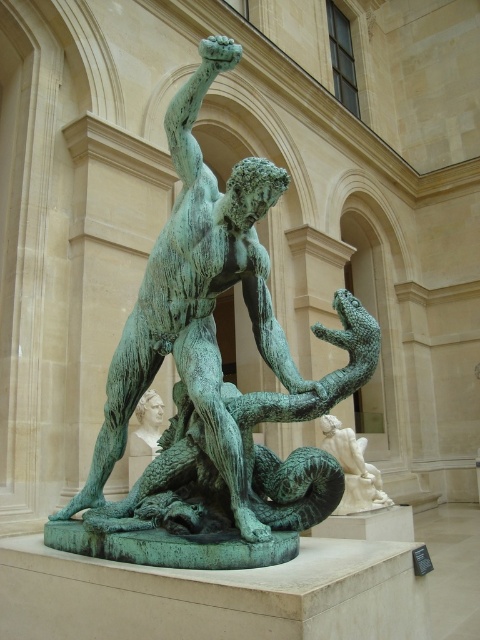
Consider the image. You are an art conservator assessing the space between two white marble artworks in the museum. The white marble statue at center and the smooth white marble bust at center are positioned side by side. Based on their sizes, which one would you need to use a taller ladder to reach the top?

The white marble statue at center is taller than the smooth white marble bust at center, so you would need a taller ladder to reach the top of the white marble statue at center.

You are a museum visitor who wants to take a photo of the green patina bronze statue at center. The museum requires visitors to maintain a distance of at least 2 meters from the statue to prevent damage. If you are standing at point (213, 381), can you take the photo while complying with the rule?

The green patina bronze statue at center is located at point (213, 381). If you are already standing at that exact point, you are at the same location as the statue, making it impossible to maintain the required 2 meters distance. Therefore, you cannot take the photo while complying with the rule.

You are a museum curator planning to install a new security system. You need to place a motion sensor between the green patina bronze statue at center and the smooth white marble bust at center. What is the minimum distance the sensor should be placed from each object to ensure it covers both?

The green patina bronze statue at center and smooth white marble bust at center are 11.42 feet apart from each other. To cover both objects, the motion sensor should be placed exactly halfway between them, which would be 5.71 feet from each object.